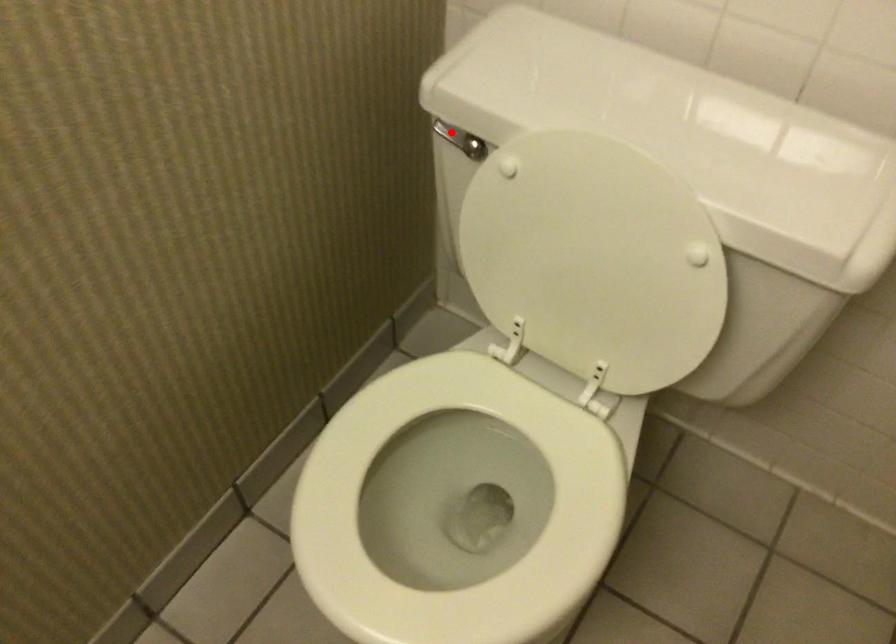
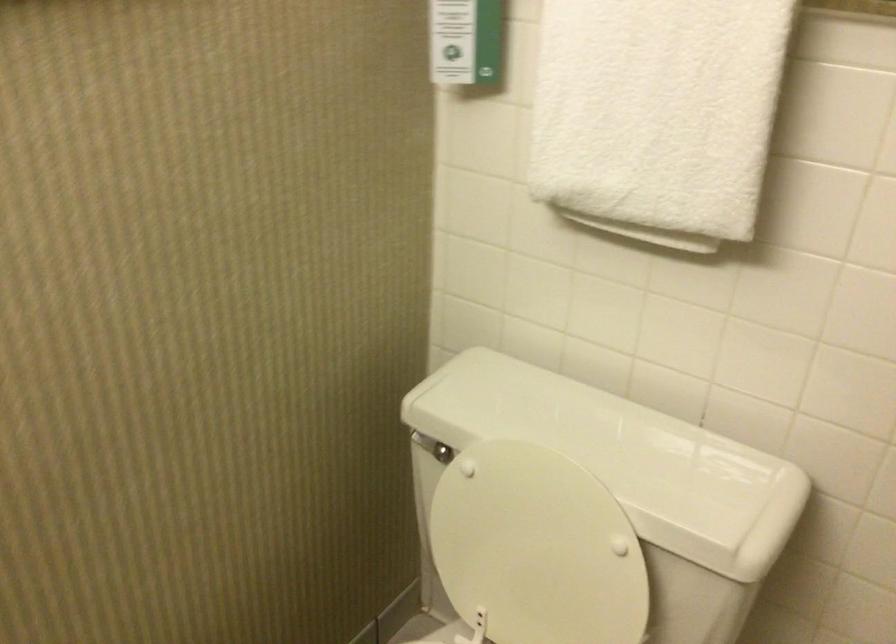
Where in the second image is the point corresponding to the highlighted location from the first image?

(425, 444)